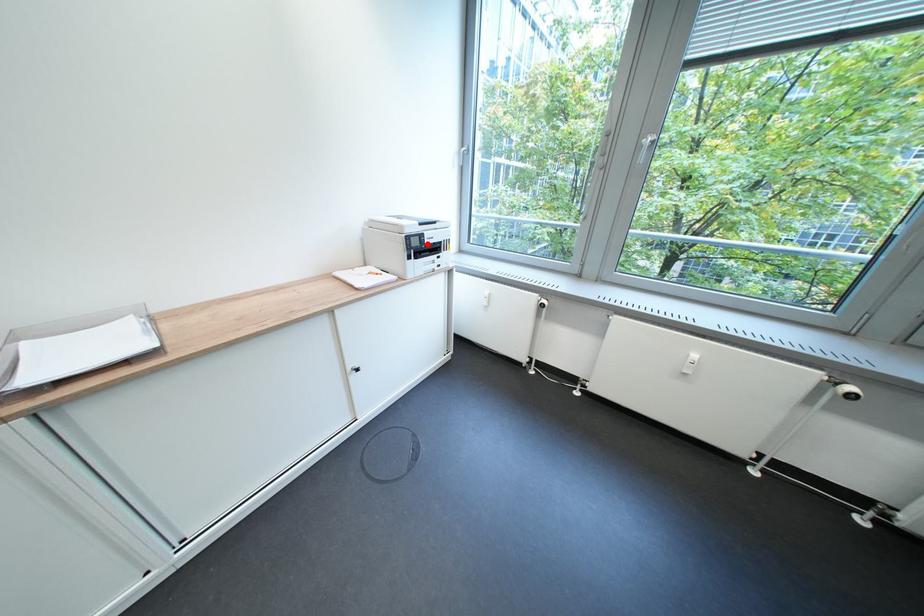
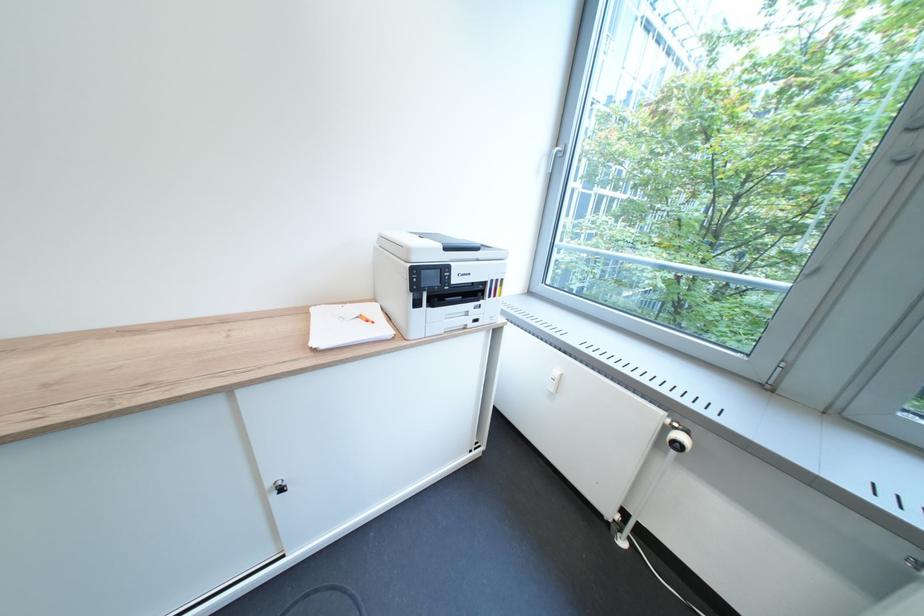
The point at the highlighted location is marked in the first image. Where is the corresponding point in the second image?

(444, 282)